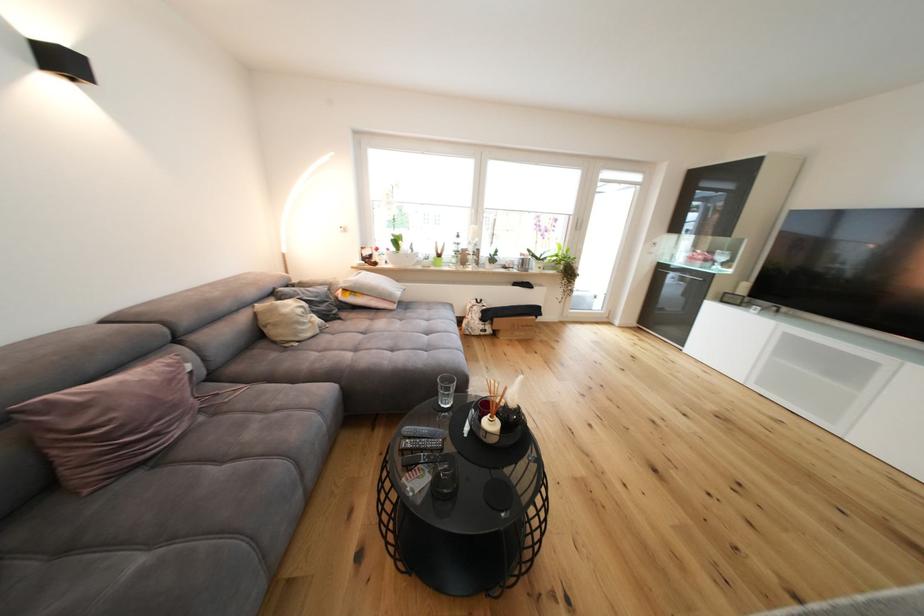
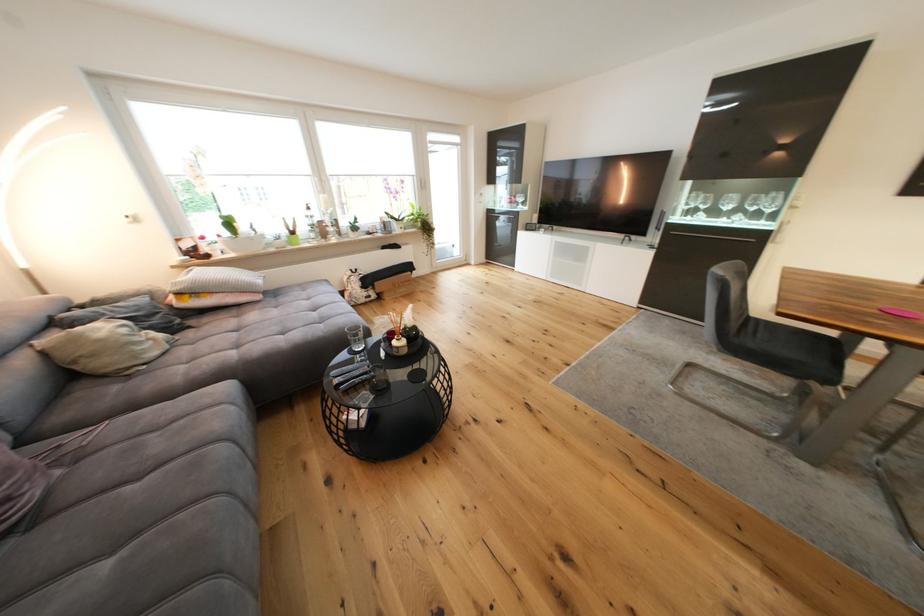
Find the pixel in the second image that matches the point at 415,431 in the first image.

(341, 374)